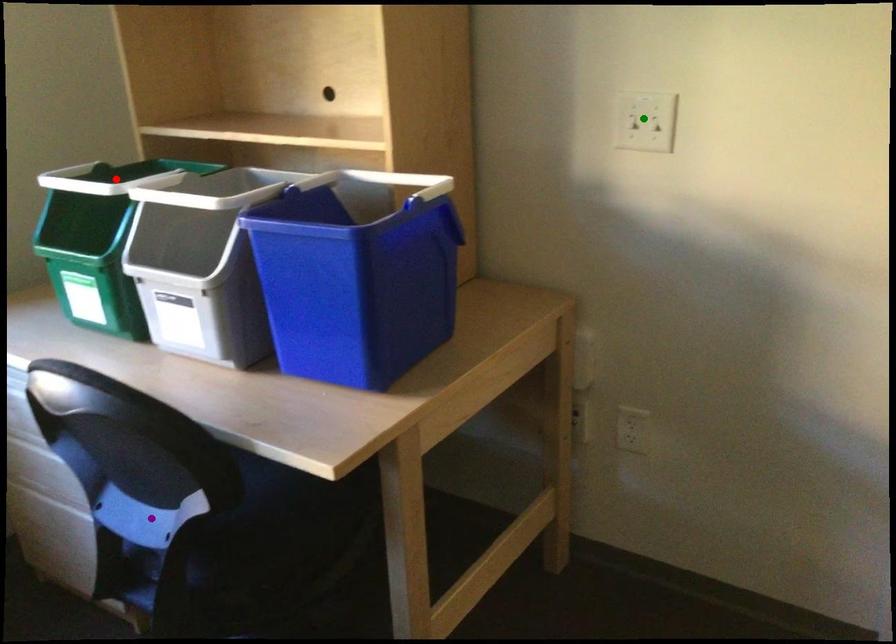
Order these from nearest to farthest:
green point | purple point | red point

Result: purple point → green point → red point